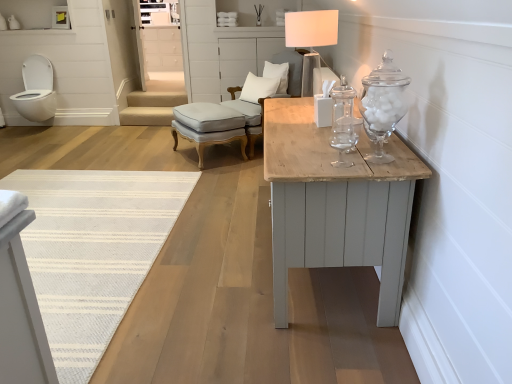
Find the location of `vacant space in front of light gray fabric stool at center`. vacant space in front of light gray fabric stool at center is located at coordinates (212, 174).